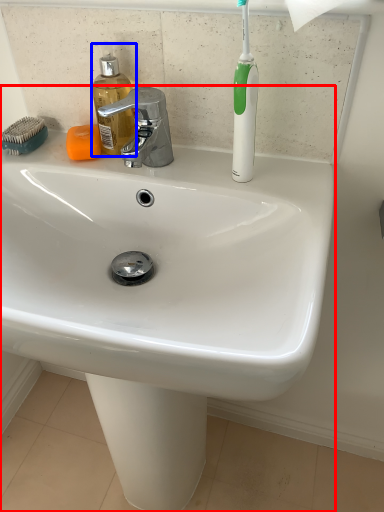
Question: Which object appears farthest to the camera in this image, sink (highlighted by a red box) or soap dispenser (highlighted by a blue box)?

Choices:
 (A) sink
 (B) soap dispenser

Answer: (B)